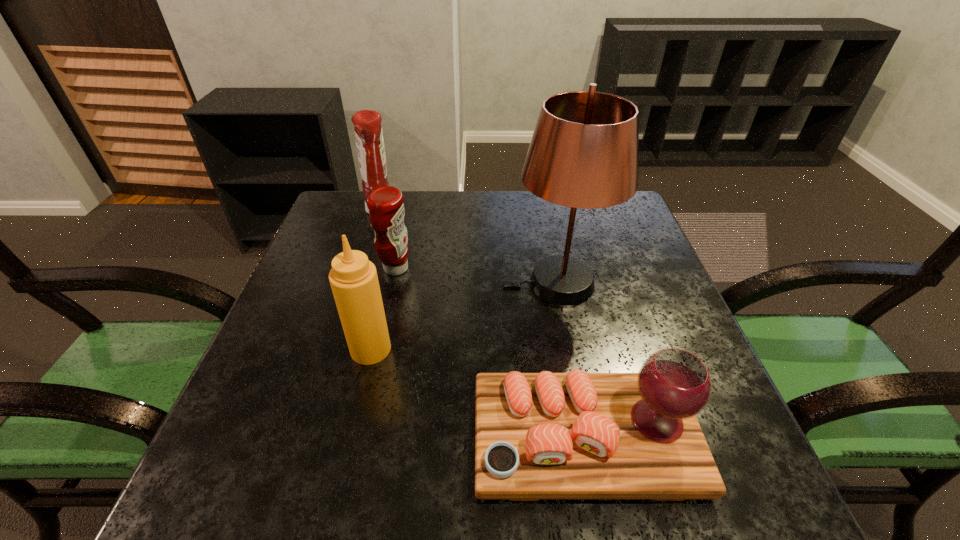
In the image, there is a desktop. In order to click on vacant space at the left edge in this screenshot , I will do `click(322, 342)`.

Where is `free region at the right edge`? free region at the right edge is located at coordinates (621, 269).

Find the location of `vacant area at the far left corner of the desktop`. vacant area at the far left corner of the desktop is located at coordinates (338, 201).

The height and width of the screenshot is (540, 960). Identify the location of free spot between the nearest object and the tallest object. (x=570, y=361).

In order to click on free space that is in between the tallest object and the platter in this screenshot , I will do `click(570, 361)`.

This screenshot has width=960, height=540. I want to click on empty space that is in between the lampshade and the second nearest object, so click(464, 316).

I want to click on vacant space in between the second farthest condiment and the tallest object, so click(476, 275).

Where is `vacant point located between the farthest condiment and the tallest object`? This screenshot has width=960, height=540. vacant point located between the farthest condiment and the tallest object is located at coordinates (468, 246).

Image resolution: width=960 pixels, height=540 pixels. In order to click on free space that is in between the lampshade and the second nearest object in this screenshot , I will do `click(464, 316)`.

The width and height of the screenshot is (960, 540). Identify the location of free point between the second nearest object and the lampshade. (464, 316).